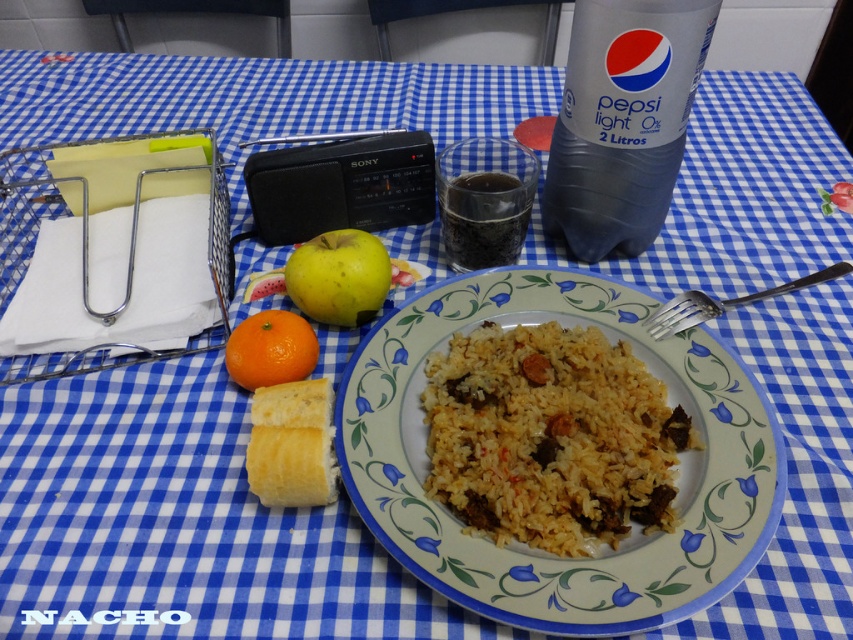
Question: Where is white glossy plate at center located in relation to yellow matte apple at center in the image?

Choices:
 (A) left
 (B) right

Answer: (B)

Question: Can you confirm if transparent glass at center is thinner than orangesmoothorange at left?

Choices:
 (A) no
 (B) yes

Answer: (A)

Question: Among these objects, which one is farthest from the camera?

Choices:
 (A) transparent glass at center
 (B) silver/black metal fork at right
 (C) black plastic radio at center

Answer: (C)

Question: Which object is closer to the camera taking this photo?

Choices:
 (A) yellowish rice at center
 (B) orangesmoothorange at left
 (C) yellow bread at center
 (D) yellow matte apple at center

Answer: (A)

Question: Is transparent glass at center above orangesmoothorange at left?

Choices:
 (A) no
 (B) yes

Answer: (B)

Question: Which object is closer to the camera taking this photo?

Choices:
 (A) orangesmoothorange at left
 (B) transparent glass at center
 (C) silver/black metal fork at right
 (D) yellowish rice at center

Answer: (D)